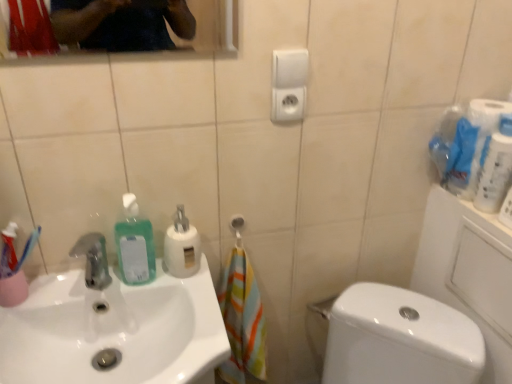
Question: Which is correct: white glossy sink at lower left is inside green translucent liquid at sink left, arranged as the first cleaning product when viewed from the left, or outside of it?

Choices:
 (A) inside
 (B) outside

Answer: (B)

Question: From their relative heights in the image, would you say white glossy sink at lower left is taller or shorter than green translucent liquid at sink left, arranged as the first cleaning product when viewed from the left?

Choices:
 (A) tall
 (B) short

Answer: (A)

Question: Considering the real-world distances, which object is farthest from the white glossy toilet at lower right?

Choices:
 (A) green translucent liquid at sink left, arranged as the first cleaning product when viewed from the left
 (B) white matte soap dispenser at center, the 2th cleaning product viewed from the left
 (C) white glossy toilet paper at upper right
 (D) white glossy sink at lower left

Answer: (A)

Question: Which object is the farthest from the white glossy toilet paper at upper right?

Choices:
 (A) white matte soap dispenser at center, which is the 1th cleaning product in right-to-left order
 (B) green translucent liquid at sink left, positioned as the second cleaning product in right-to-left order
 (C) white glossy toilet at lower right
 (D) white glossy sink at lower left

Answer: (D)